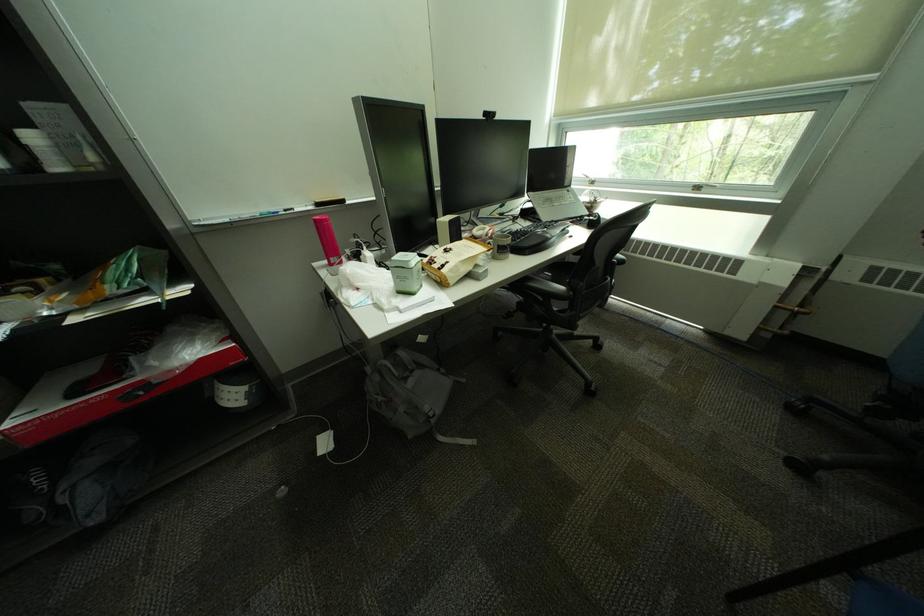
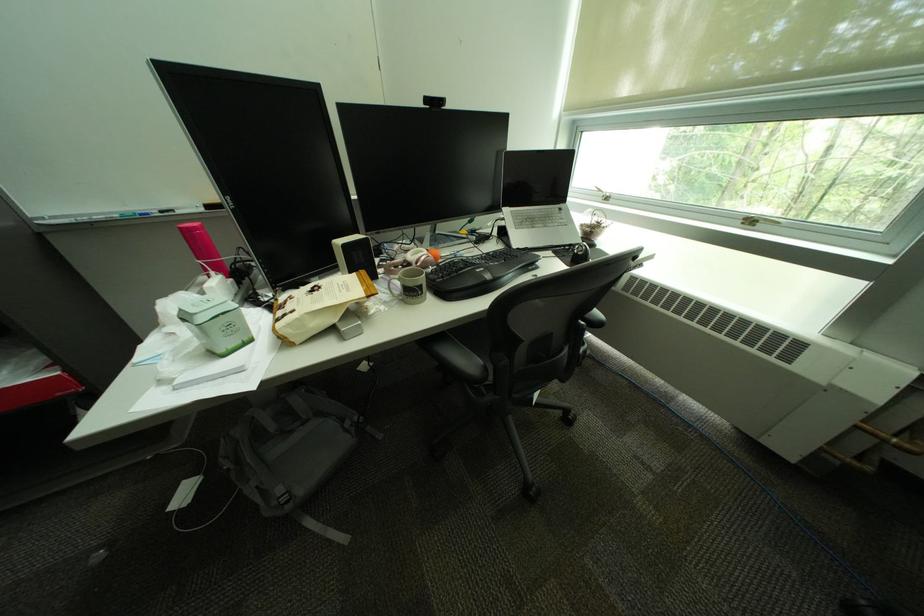
In the second image, find the point that corresponds to (x=626, y=262) in the first image.

(593, 323)